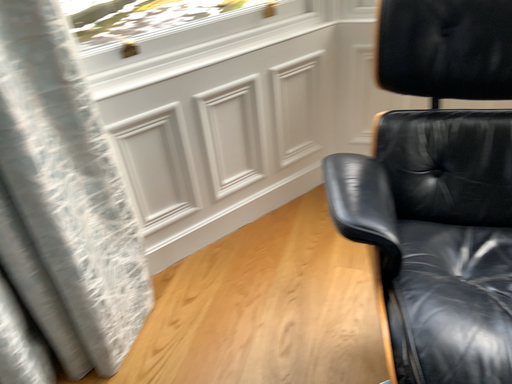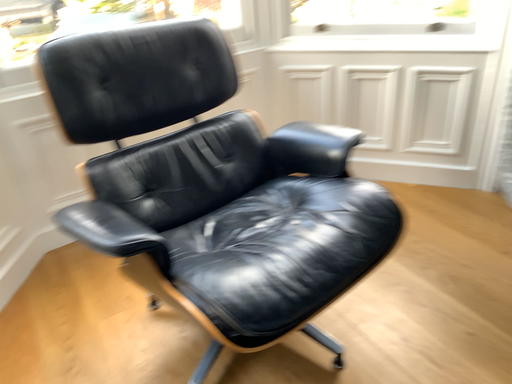
Question: How did the camera likely rotate when shooting the video?

Choices:
 (A) rotated left
 (B) rotated right

Answer: (B)